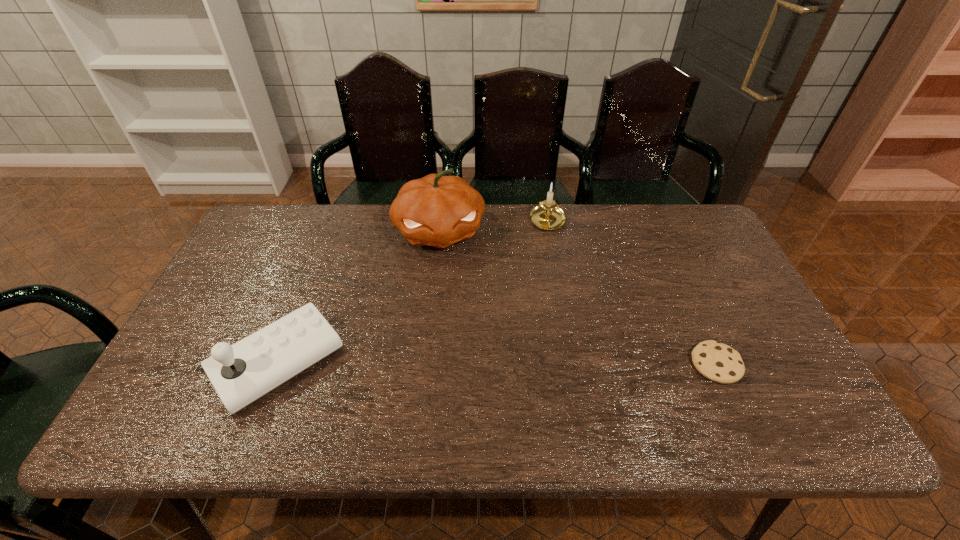
The width and height of the screenshot is (960, 540). Find the location of `vacant space that is in between the candle holder and the cookie`. vacant space that is in between the candle holder and the cookie is located at coordinates (632, 293).

At what (x,y) coordinates should I click in order to perform the action: click on vacant space in between the candle holder and the pumpkin. Please return your answer as a coordinate pair (x, y). Looking at the image, I should click on (493, 226).

Where is `vacant point located between the candle holder and the leftmost object`? vacant point located between the candle holder and the leftmost object is located at coordinates (413, 292).

You are a GUI agent. You are given a task and a screenshot of the screen. Output one action in this format:
    pyautogui.click(x=<x>, y=<y>)
    Task: Click on the free space between the shortest object and the tallest object
    The height and width of the screenshot is (540, 960).
    Given the screenshot: What is the action you would take?
    pyautogui.click(x=578, y=298)

Identify the location of vacant space that's between the third object from right to left and the rightmost object. (578, 298).

In order to click on vacant point located between the shortest object and the second object from right to left in this screenshot , I will do 632,293.

Point out which object is positioned as the third nearest to the leftmost object. Please provide its 2D coordinates. Your answer should be formatted as a tuple, i.e. [(x, y)], where the tuple contains the x and y coordinates of a point satisfying the conditions above.

[(718, 362)]

Find the location of a particular element. The image size is (960, 540). object that ranks as the second closest to the shortest object is located at coordinates (437, 210).

Where is `free space that satisfies the following two spatial constraints: 1. on the front side of the cookie; 2. on the left side of the leftmost object`? This screenshot has width=960, height=540. free space that satisfies the following two spatial constraints: 1. on the front side of the cookie; 2. on the left side of the leftmost object is located at coordinates (278, 364).

Where is `blank space that satisfies the following two spatial constraints: 1. on the front side of the leftmost object; 2. on the left side of the cookie`? The image size is (960, 540). blank space that satisfies the following two spatial constraints: 1. on the front side of the leftmost object; 2. on the left side of the cookie is located at coordinates (278, 364).